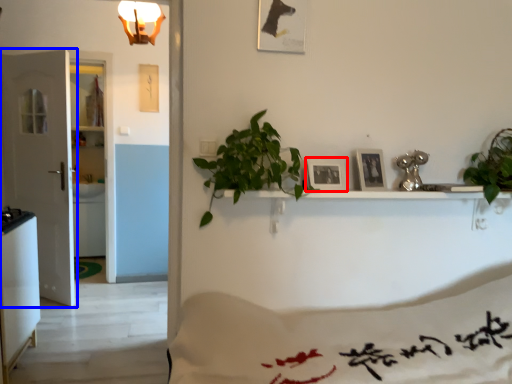
Question: Which point is further to the camera, picture frame (highlighted by a red box) or door (highlighted by a blue box)?

Choices:
 (A) picture frame
 (B) door

Answer: (B)